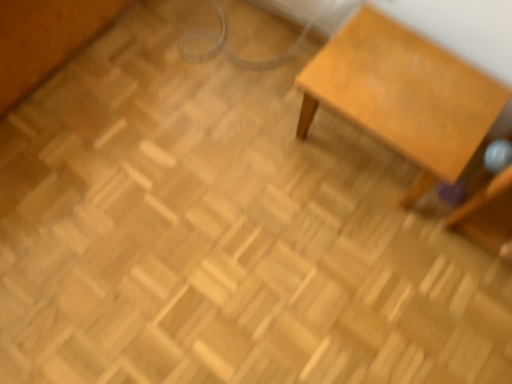
Where is `vacant space underneath light brown wooden table at upper right (from a real-world perspective)`? This screenshot has width=512, height=384. vacant space underneath light brown wooden table at upper right (from a real-world perspective) is located at coordinates (366, 157).